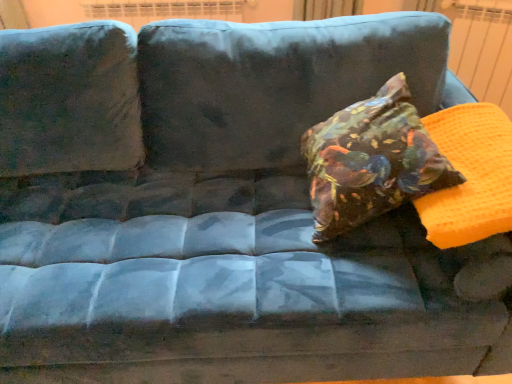
Question: Should I look upward or downward to see orange waffle-patterned radiator at upper right?

Choices:
 (A) down
 (B) up

Answer: (B)

Question: Could you tell me if floral fabric pillow at center is facing orange waffle-patterned radiator at upper right?

Choices:
 (A) no
 (B) yes

Answer: (A)

Question: Considering the relative sizes of floral fabric pillow at center and orange waffle-patterned radiator at upper right in the image provided, is floral fabric pillow at center thinner than orange waffle-patterned radiator at upper right?

Choices:
 (A) no
 (B) yes

Answer: (A)

Question: Is orange waffle-patterned radiator at upper right a part of floral fabric pillow at center?

Choices:
 (A) no
 (B) yes

Answer: (A)

Question: Is floral fabric pillow at center shorter than orange waffle-patterned radiator at upper right?

Choices:
 (A) no
 (B) yes

Answer: (B)

Question: Is floral fabric pillow at center positioned with its back to orange waffle-patterned radiator at upper right?

Choices:
 (A) yes
 (B) no

Answer: (B)

Question: Is floral fabric pillow at center placed right next to orange waffle-patterned radiator at upper right?

Choices:
 (A) no
 (B) yes

Answer: (A)

Question: Considering the relative sizes of orange waffle-patterned radiator at upper right and floral fabric pillow at center in the image provided, is orange waffle-patterned radiator at upper right wider than floral fabric pillow at center?

Choices:
 (A) yes
 (B) no

Answer: (B)

Question: Is orange waffle-patterned radiator at upper right with floral fabric pillow at center?

Choices:
 (A) no
 (B) yes

Answer: (A)

Question: Is the position of orange waffle-patterned radiator at upper right more distant than that of floral fabric pillow at center?

Choices:
 (A) yes
 (B) no

Answer: (A)

Question: From a real-world perspective, is orange waffle-patterned radiator at upper right located higher than floral fabric pillow at center?

Choices:
 (A) no
 (B) yes

Answer: (A)

Question: Is orange waffle-patterned radiator at upper right located outside floral fabric pillow at center?

Choices:
 (A) no
 (B) yes

Answer: (B)

Question: From the image's perspective, would you say orange waffle-patterned radiator at upper right is positioned over floral fabric pillow at center?

Choices:
 (A) no
 (B) yes

Answer: (B)

Question: Is floral fabric pillow at center situated inside orange waffle-patterned radiator at upper right or outside?

Choices:
 (A) outside
 (B) inside

Answer: (A)